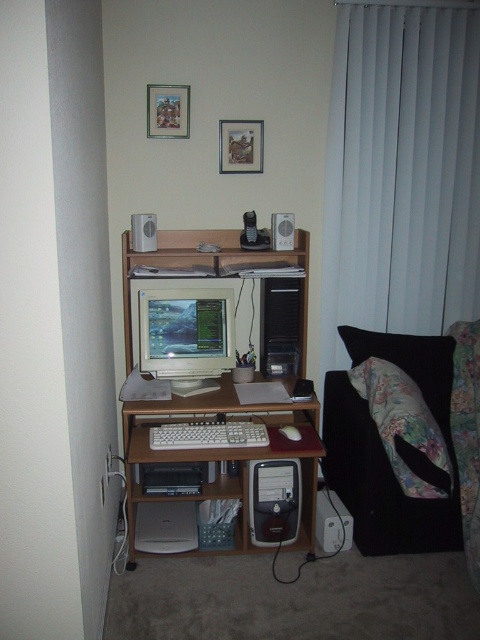
You are organizing your desk and need to place a new item between the white plastic keyboard at center and the white plastic speaker at upper center. Based on their heights, which object should be placed lower to ensure stability?

The white plastic keyboard at center is not as tall as the white plastic speaker at upper center, so placing the keyboard lower would ensure stability since it is shorter and less likely to tip over.

You are standing in the home office and want to reach the point marked at coordinates point (249, 472). If your arm can extend 6 feet, can you reach it without moving?

The distance between you and point (249, 472) is 8.09 feet, which is farther than your arm can reach. You cannot reach it without moving.

You are standing in the home office scene described. Where is the white vertical blinds at right located in terms of its 2D coordinates?

The white vertical blinds at right is located at the 2D coordinates point [402,173].